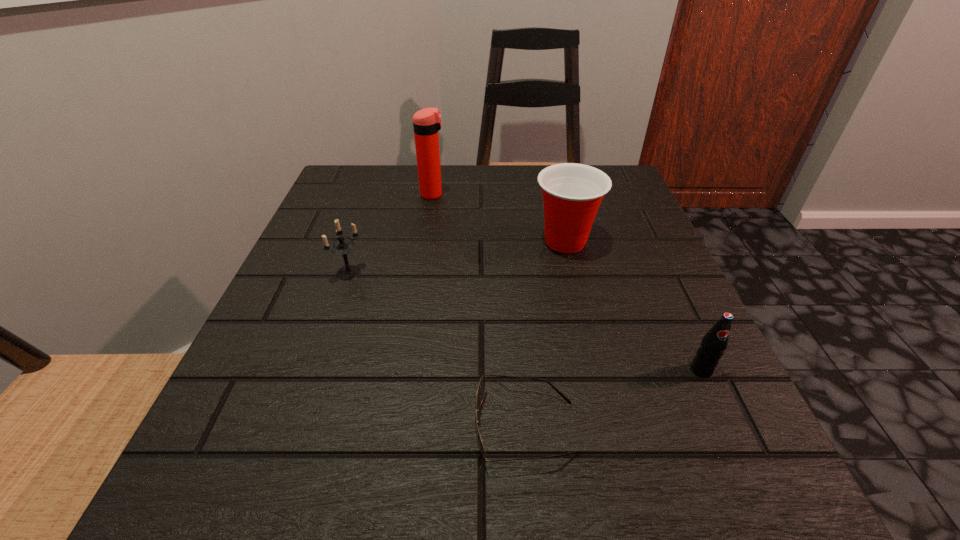
Identify which object is the second closest to the thermos bottle. Please provide its 2D coordinates. Your answer should be formatted as a tuple, i.e. [(x, y)], where the tuple contains the x and y coordinates of a point satisfying the conditions above.

[(342, 247)]

Identify which object is located as the third nearest to the pop. Please provide its 2D coordinates. Your answer should be formatted as a tuple, i.e. [(x, y)], where the tuple contains the x and y coordinates of a point satisfying the conditions above.

[(342, 247)]

Where is `blank area in the image that satisfies the following two spatial constraints: 1. on the front side of the second farthest object; 2. on the front-facing side of the sunglasses`? Image resolution: width=960 pixels, height=540 pixels. blank area in the image that satisfies the following two spatial constraints: 1. on the front side of the second farthest object; 2. on the front-facing side of the sunglasses is located at coordinates (611, 427).

Identify the location of free space in the image that satisfies the following two spatial constraints: 1. on the front label of the rightmost object; 2. on the front-facing side of the nearest object. (728, 427).

Image resolution: width=960 pixels, height=540 pixels. Find the location of `free location that satisfies the following two spatial constraints: 1. on the front label of the pop; 2. on the front-facing side of the shortest object`. free location that satisfies the following two spatial constraints: 1. on the front label of the pop; 2. on the front-facing side of the shortest object is located at coordinates (728, 427).